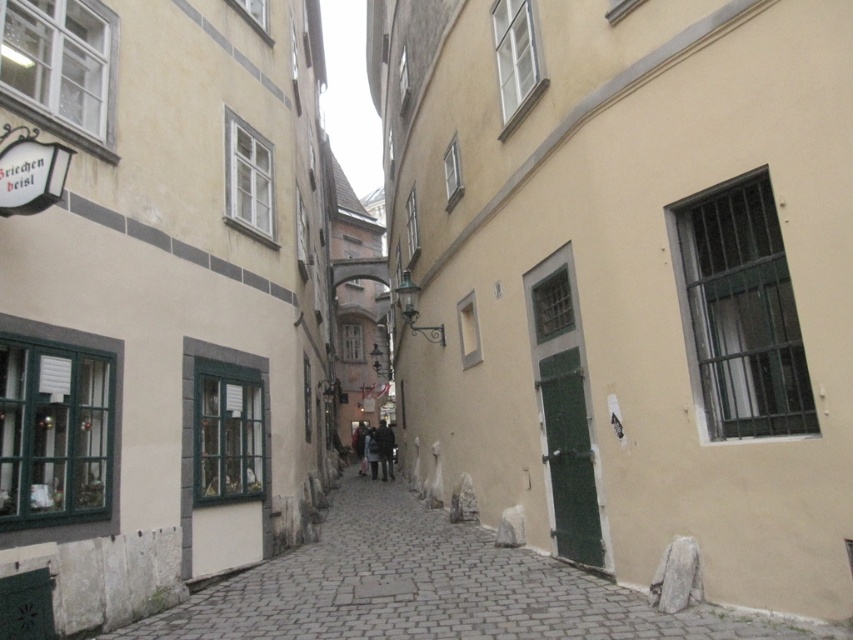
Does smooth stone wall at lower left appear under dark gray fabric coat at center?

No, smooth stone wall at lower left is not below dark gray fabric coat at center.

Can you confirm if smooth stone wall at lower left is positioned to the left of dark gray fabric coat at center?

Indeed, smooth stone wall at lower left is positioned on the left side of dark gray fabric coat at center.

Between point (521, 612) and point (357, 440), which one is positioned in front?

Point (521, 612)

Find the location of a particular element. smooth stone wall at lower left is located at coordinates (434, 588).